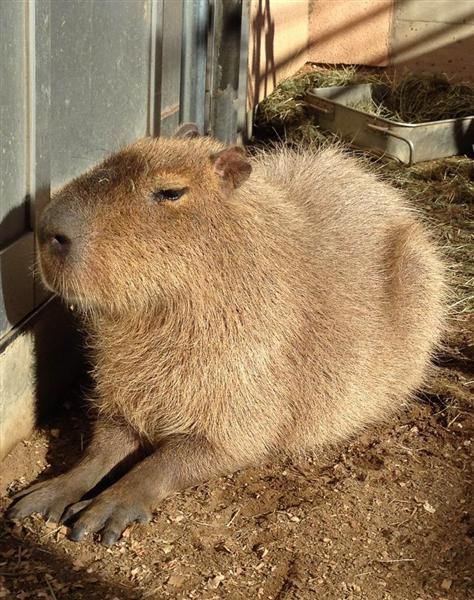
Locate an element on the screen. left wall is located at coordinates (278, 33).